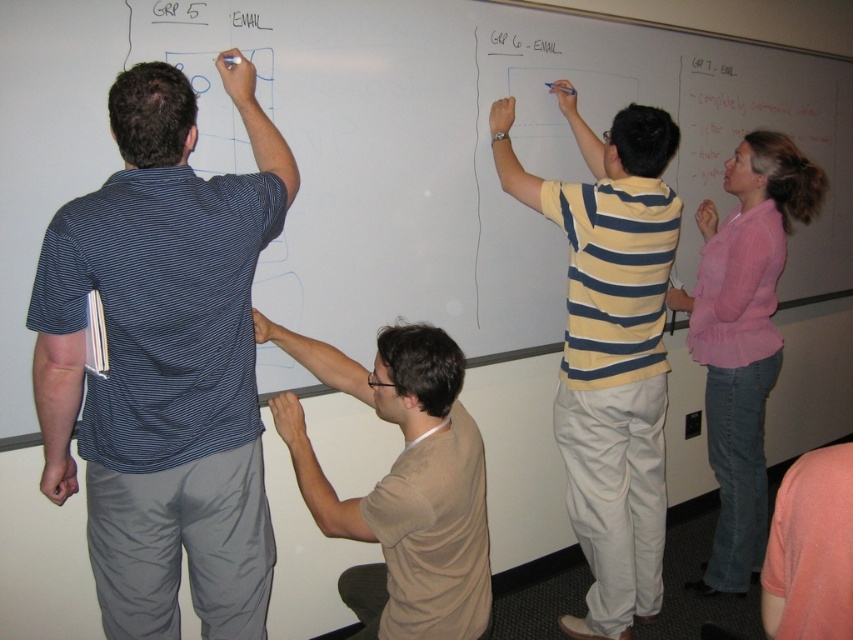
What are the coordinates of the blue striped shirt at left?

The coordinates of the blue striped shirt at left are at point (164, 362).